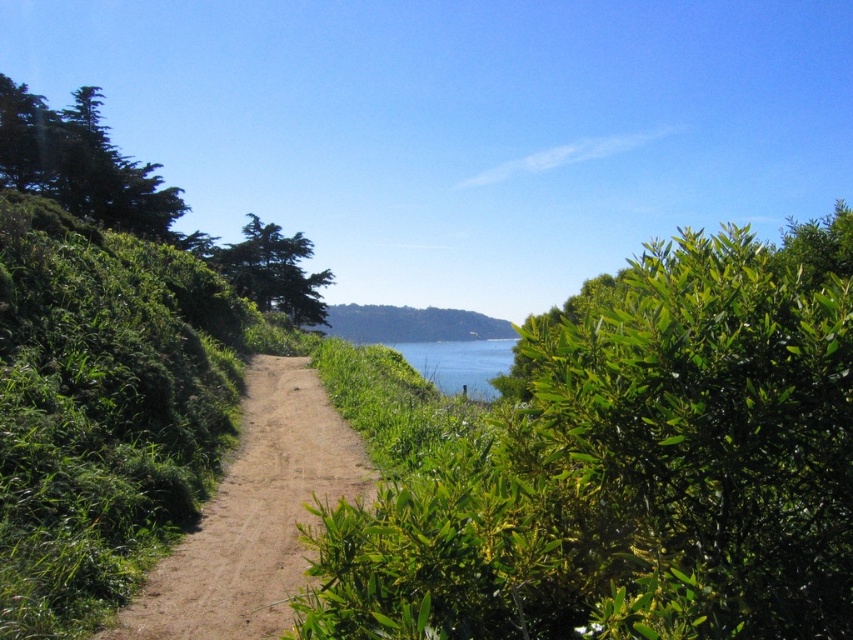
Question: Which point is closer to the camera?

Choices:
 (A) (28, 131)
 (B) (492, 376)

Answer: (A)

Question: Does green leafy bush at center appear on the left side of green textured tree at upper center?

Choices:
 (A) no
 (B) yes

Answer: (A)

Question: Observing the image, what is the correct spatial positioning of green textured tree at upper center in reference to blue water at center?

Choices:
 (A) above
 (B) below

Answer: (A)

Question: Which of the following is the farthest from the observer?

Choices:
 (A) dirt path at center
 (B) blue water at center
 (C) green leafy bush at center

Answer: (B)

Question: Among these points, which one is farthest from the camera?

Choices:
 (A) (74, 202)
 (B) (595, 554)
 (C) (263, 532)

Answer: (A)

Question: Does green leafy bush at center appear over dirt path at center?

Choices:
 (A) yes
 (B) no

Answer: (A)